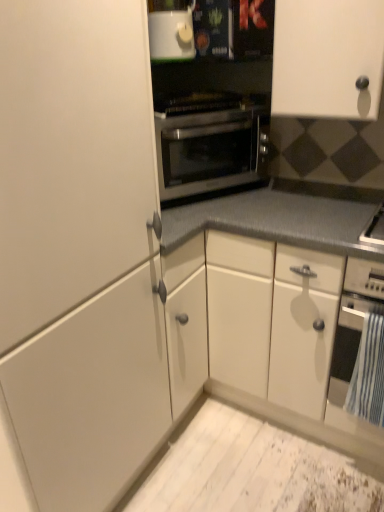
Question: Is stainless steel oven at center, marked as the 2th oven in a bottom-to-top arrangement, bigger than white matte cabinet at upper right, marked as the 1th cabinetry in a right-to-left arrangement?

Choices:
 (A) no
 (B) yes

Answer: (A)

Question: Considering the relative positions of stainless steel oven at center, which appears as the second oven when viewed from the right, and white matte cabinet at upper right, marked as the 1th cabinetry in a right-to-left arrangement, in the image provided, is stainless steel oven at center, which appears as the second oven when viewed from the right, to the right of white matte cabinet at upper right, marked as the 1th cabinetry in a right-to-left arrangement, from the viewer's perspective?

Choices:
 (A) yes
 (B) no

Answer: (B)

Question: Does stainless steel oven at center, which appears as the second oven when viewed from the right, appear on the left side of white matte cabinet at upper right, marked as the 1th cabinetry in a right-to-left arrangement?

Choices:
 (A) yes
 (B) no

Answer: (A)

Question: From a real-world perspective, is stainless steel oven at center, the 1th oven viewed from the top, physically below white matte cabinet at upper right, marked as the 1th cabinetry in a right-to-left arrangement?

Choices:
 (A) no
 (B) yes

Answer: (B)

Question: Is stainless steel oven at center, which appears as the second oven when viewed from the right, placed right next to white matte cabinet at upper right, marked as the 1th cabinetry in a right-to-left arrangement?

Choices:
 (A) no
 (B) yes

Answer: (A)

Question: Is the depth of stainless steel oven at center, positioned as the first oven in left-to-right order, greater than that of white matte cabinet at upper right, which appears as the 2th cabinetry when viewed from the left?

Choices:
 (A) yes
 (B) no

Answer: (A)

Question: Can you confirm if black matte oven at lower right, the second oven positioned from the left, is thinner than white matte cabinet at left, the first cabinetry in the left-to-right sequence?

Choices:
 (A) yes
 (B) no

Answer: (A)

Question: Is black matte oven at lower right, arranged as the first oven when viewed from the right, placed right next to white matte cabinet at left, the 2th cabinetry positioned from the right?

Choices:
 (A) yes
 (B) no

Answer: (B)

Question: Considering the relative sizes of black matte oven at lower right, arranged as the second oven when viewed from the top, and white matte cabinet at left, the first cabinetry in the left-to-right sequence, in the image provided, is black matte oven at lower right, arranged as the second oven when viewed from the top, bigger than white matte cabinet at left, the first cabinetry in the left-to-right sequence,?

Choices:
 (A) yes
 (B) no

Answer: (B)

Question: Is black matte oven at lower right, arranged as the 1th oven when ordered from the bottom, facing towards white matte cabinet at left, the 2th cabinetry positioned from the right?

Choices:
 (A) yes
 (B) no

Answer: (B)

Question: From a real-world perspective, does black matte oven at lower right, arranged as the second oven when viewed from the top, stand above white matte cabinet at left, the first cabinetry in the left-to-right sequence?

Choices:
 (A) no
 (B) yes

Answer: (A)

Question: From the image's perspective, is black matte oven at lower right, arranged as the first oven when viewed from the right, on top of white matte cabinet at left, the 2th cabinetry positioned from the right?

Choices:
 (A) yes
 (B) no

Answer: (B)

Question: Is the position of stainless steel oven at center, marked as the 2th oven in a bottom-to-top arrangement, more distant than that of white matte cabinet at left, the first cabinetry in the left-to-right sequence?

Choices:
 (A) yes
 (B) no

Answer: (A)